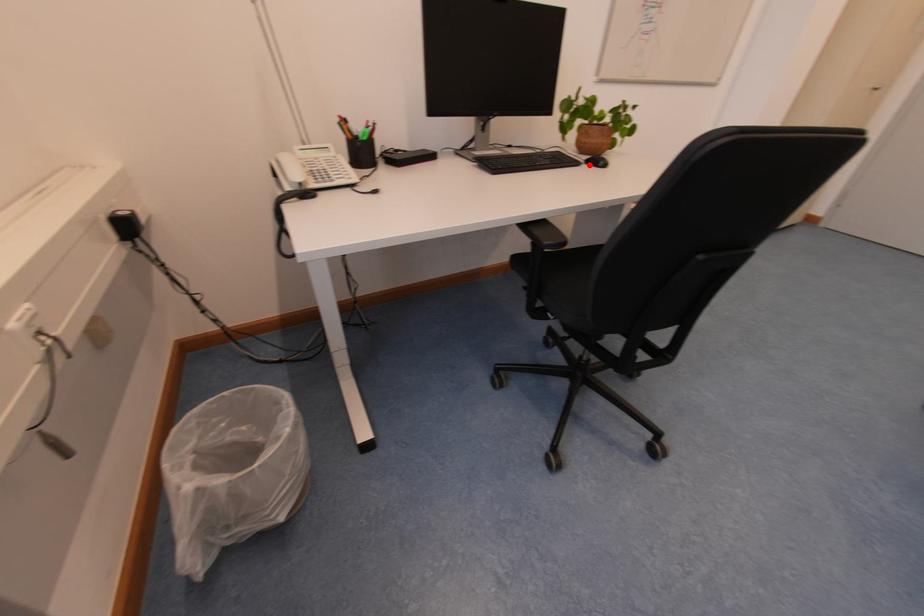
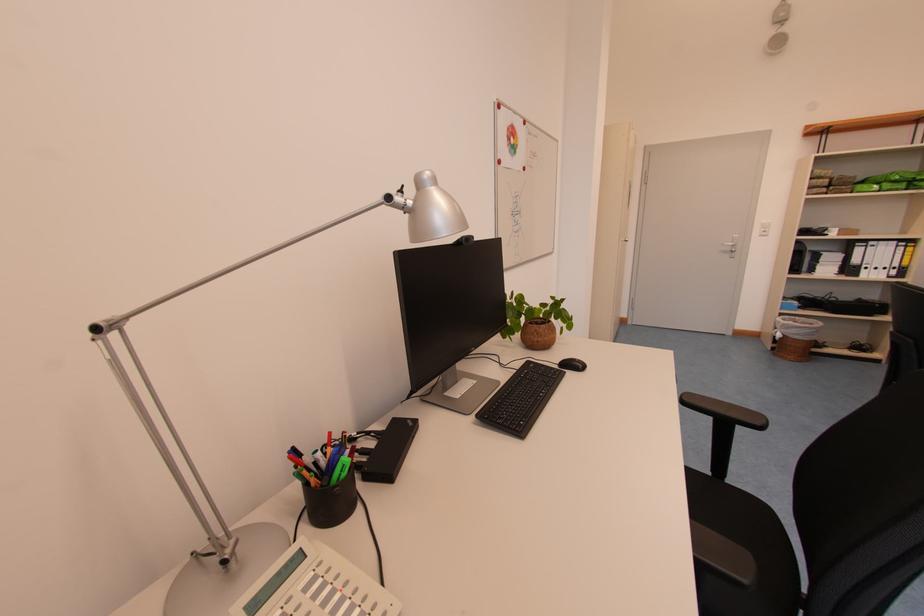
Locate, in the second image, the point that corresponds to the highlighted location in the first image.

(564, 369)